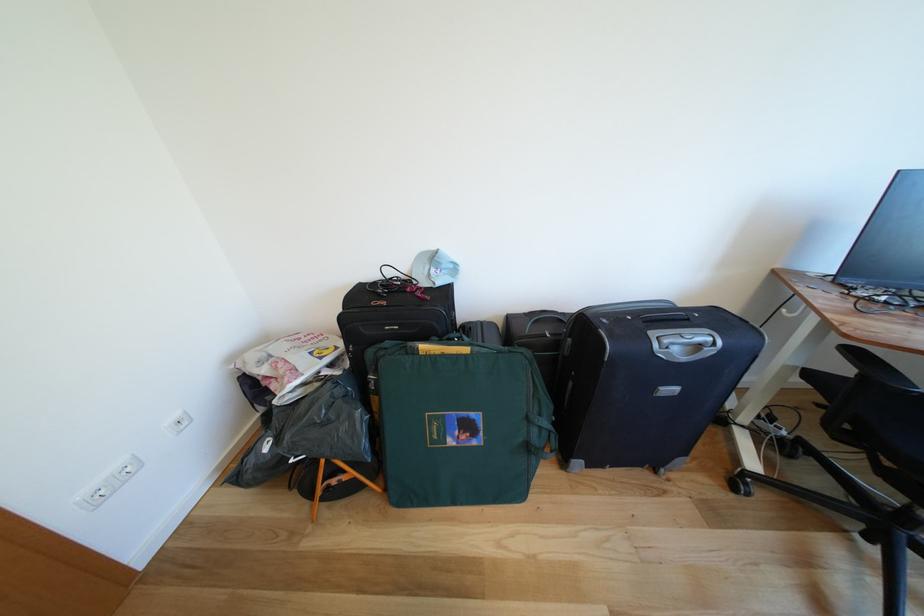
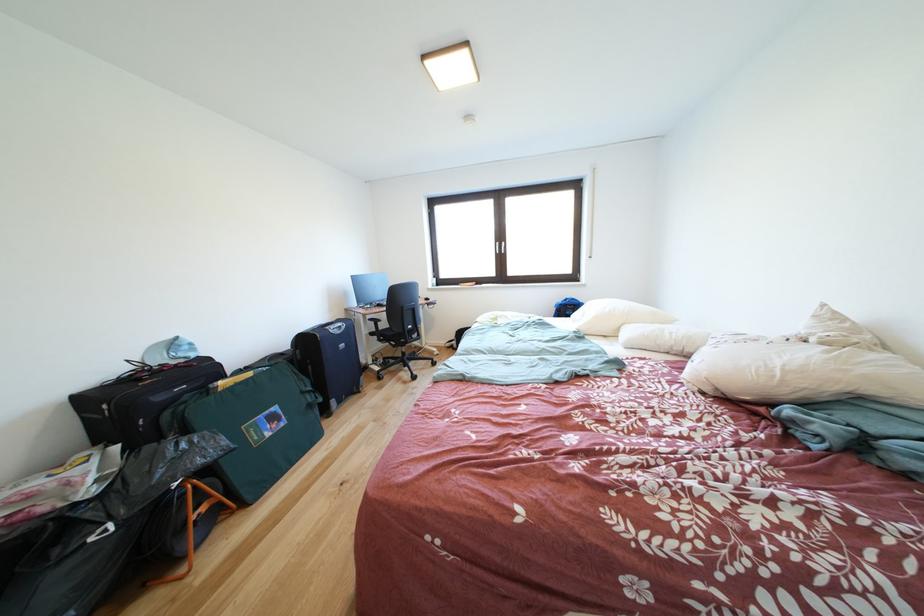
Locate, in the second image, the point that corresponds to point 893,477 in the first image.

(403, 351)